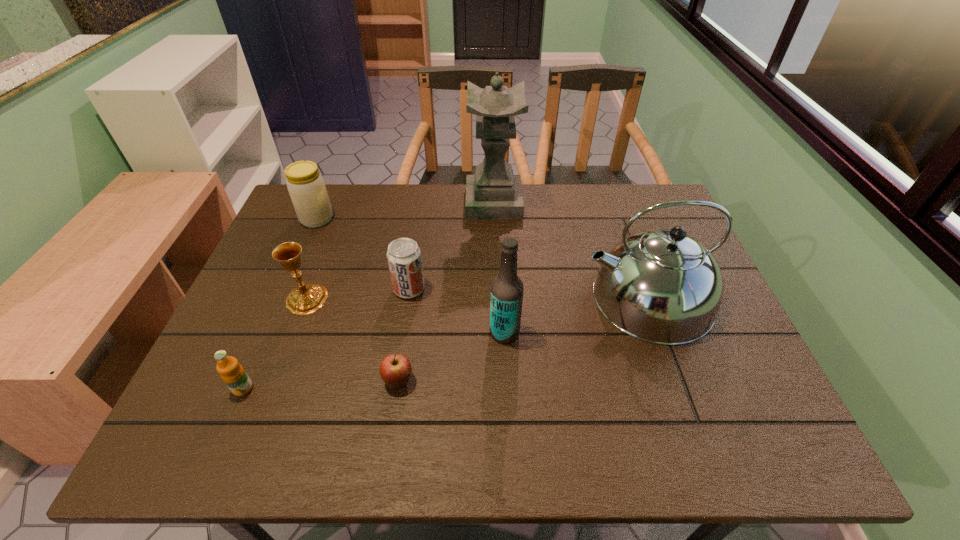
You are a GUI agent. You are given a task and a screenshot of the screen. Output one action in this format:
    pyautogui.click(x=<x>, y=<y>)
    Task: Click on the vacant space at the near edge
    This screenshot has width=960, height=540.
    Given the screenshot: What is the action you would take?
    pyautogui.click(x=291, y=448)

The height and width of the screenshot is (540, 960). What are the coordinates of `vacant region at the left edge of the desktop` in the screenshot? It's located at (271, 309).

Where is `vacant area at the right edge of the desktop`? The height and width of the screenshot is (540, 960). vacant area at the right edge of the desktop is located at coordinates 721,329.

Image resolution: width=960 pixels, height=540 pixels. I want to click on free space at the near left corner of the desktop, so click(201, 421).

The width and height of the screenshot is (960, 540). Find the location of `free location at the far right corner of the desktop`. free location at the far right corner of the desktop is located at coordinates (626, 211).

The image size is (960, 540). What are the coordinates of `free space that is in between the shortest object and the beer bottle` in the screenshot? It's located at (451, 356).

The height and width of the screenshot is (540, 960). Find the location of `free space between the tallest object and the soda can`. free space between the tallest object and the soda can is located at coordinates (451, 246).

At what (x,y) coordinates should I click in order to perform the action: click on free spot between the jar and the tallest object. Please return your answer as a coordinate pair (x, y). This screenshot has height=540, width=960. Looking at the image, I should click on (405, 211).

Identify the location of free space between the jar and the second shortest object. (280, 303).

Find the location of a particular element. This screenshot has width=960, height=540. empty location between the soda can and the chalice is located at coordinates (358, 294).